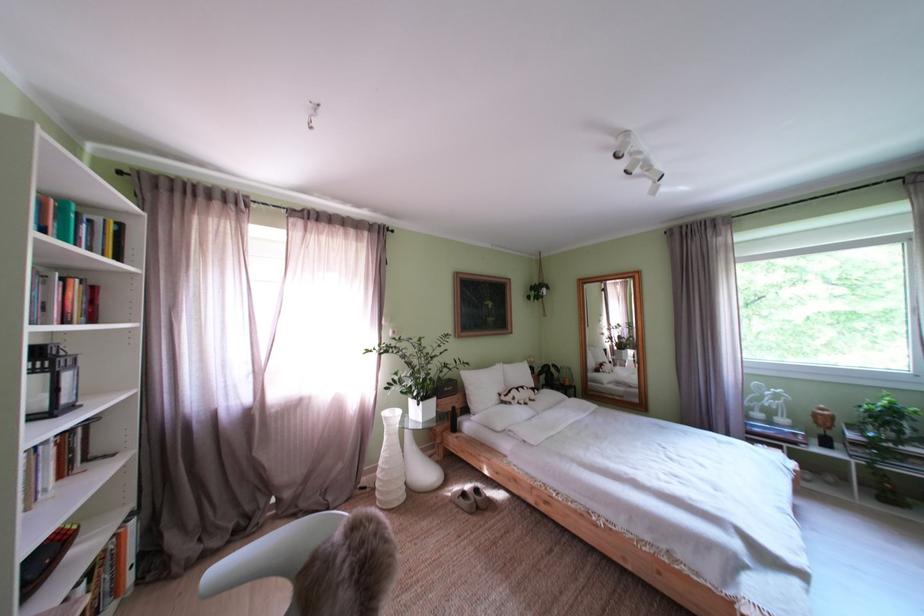
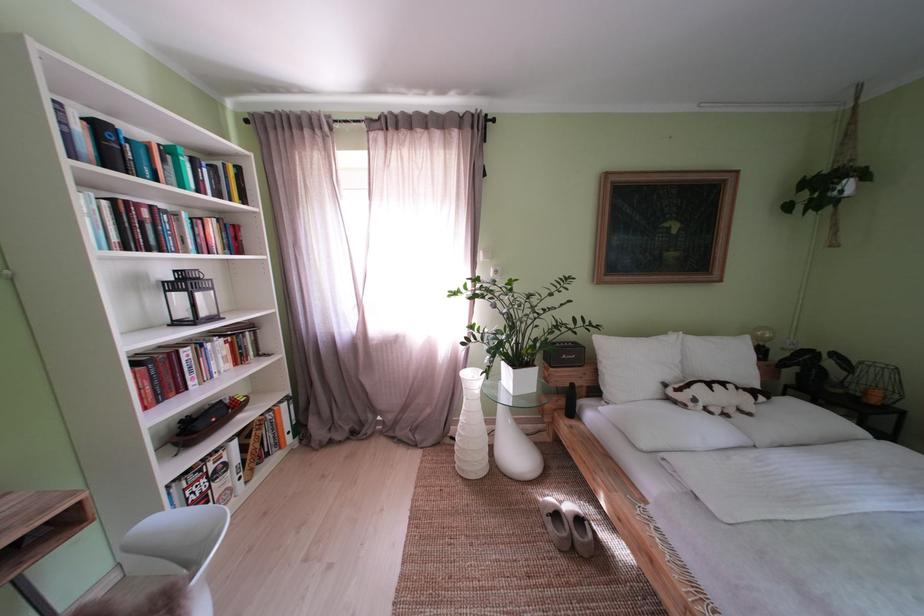
Where in the second image is the point corresponding to (395,460) from the first image?

(472, 424)